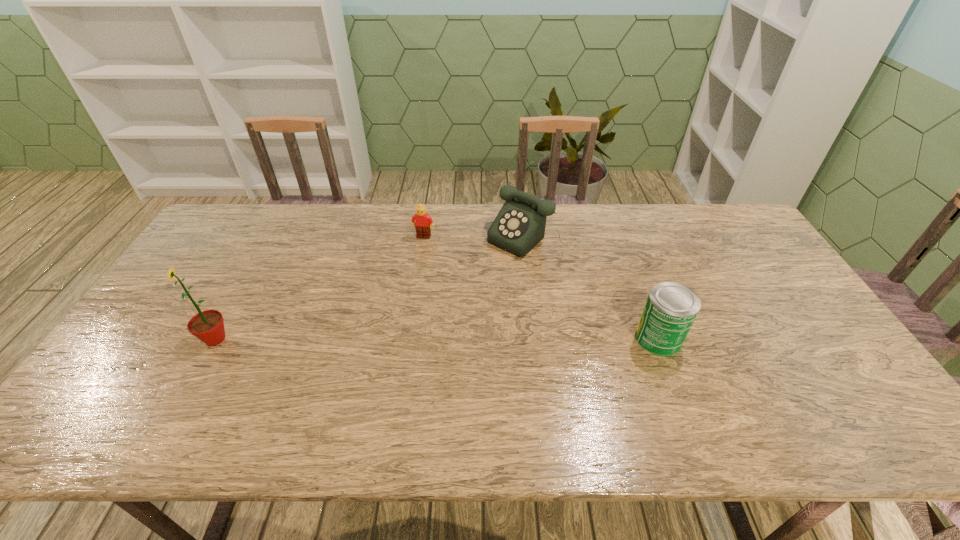
Find the location of a particular element. This screenshot has height=540, width=960. free space located 0.270m on the dial of the telephone is located at coordinates (454, 303).

This screenshot has height=540, width=960. I want to click on vacant space located 0.370m on the dial of the telephone, so click(431, 324).

The image size is (960, 540). Find the location of `vacant space located on the dial of the telephone`. vacant space located on the dial of the telephone is located at coordinates (454, 303).

This screenshot has height=540, width=960. I want to click on vacant region located 0.290m on the face of the shortest object, so click(x=404, y=301).

Image resolution: width=960 pixels, height=540 pixels. Identify the location of free point located on the face of the shortest object. 405,296.

Locate an element on the screen. This screenshot has height=540, width=960. vacant space situated on the face of the shortest object is located at coordinates (416, 262).

Identify the location of telephone that is at the far edge. (520, 225).

Where is `Lego at the far edge`? This screenshot has height=540, width=960. Lego at the far edge is located at coordinates (422, 221).

The height and width of the screenshot is (540, 960). Find the location of `vacant position at the far edge of the desktop`. vacant position at the far edge of the desktop is located at coordinates (328, 239).

This screenshot has height=540, width=960. I want to click on vacant space at the near edge of the desktop, so click(x=726, y=402).